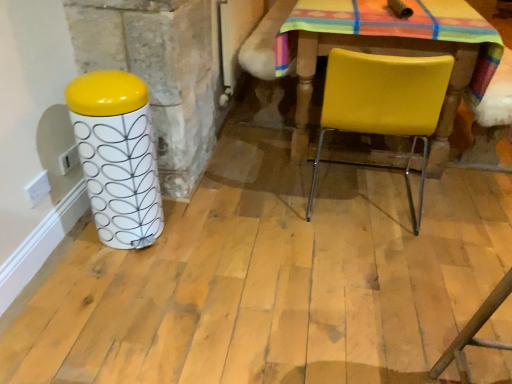
Question: Considering the positions of point (104, 175) and point (419, 104), is point (104, 175) closer or farther from the camera than point (419, 104)?

Choices:
 (A) farther
 (B) closer

Answer: (B)

Question: From the image's perspective, is white glossy patterned canister at left positioned above or below yellow leather chair at center?

Choices:
 (A) above
 (B) below

Answer: (B)

Question: Is white glossy patterned canister at left taller or shorter than yellow leather chair at center?

Choices:
 (A) tall
 (B) short

Answer: (B)

Question: From the image's perspective, is yellow leather chair at center above or below white glossy patterned canister at left?

Choices:
 (A) above
 (B) below

Answer: (A)

Question: Is yellow leather chair at center in front of or behind white glossy patterned canister at left in the image?

Choices:
 (A) front
 (B) behind

Answer: (B)

Question: Is yellow leather chair at center inside or outside of white glossy patterned canister at left?

Choices:
 (A) inside
 (B) outside

Answer: (B)

Question: In terms of width, does yellow leather chair at center look wider or thinner when compared to white glossy patterned canister at left?

Choices:
 (A) thin
 (B) wide

Answer: (B)